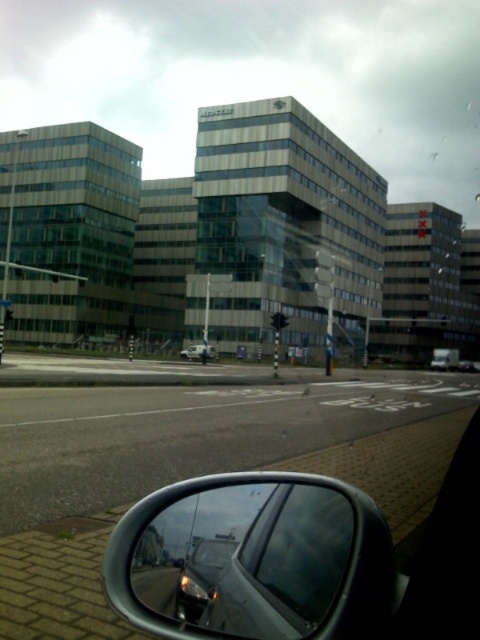
You are a driver checking your rearview mirror and side mirrors. You notice the shiny silver mirror at lower right and the transparent glass car window at lower center. Which of these two has a bigger surface area?

The shiny silver mirror at lower right has a larger size compared to the transparent glass car window at lower center, so it has a bigger surface area.